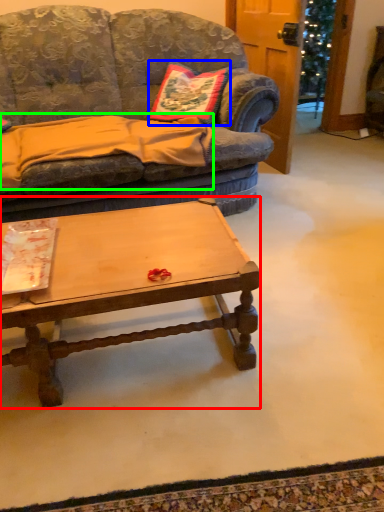
Question: Which object is positioned farthest from coffee table (highlighted by a red box)? Select from pillow (highlighted by a blue box) and blanket (highlighted by a green box).

Choices:
 (A) pillow
 (B) blanket

Answer: (A)